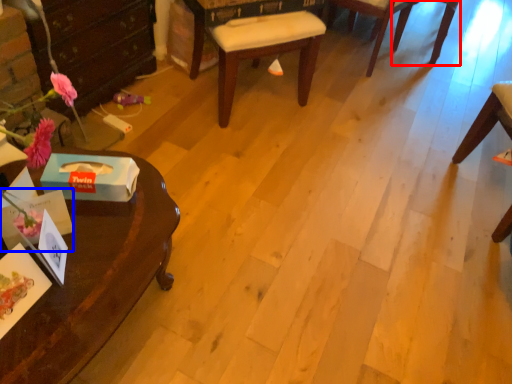
Question: Which point is closer to the camera, chair (highlighted by a red box) or box (highlighted by a blue box)?

Choices:
 (A) chair
 (B) box

Answer: (B)